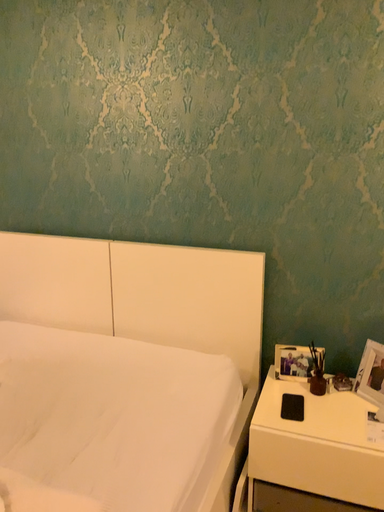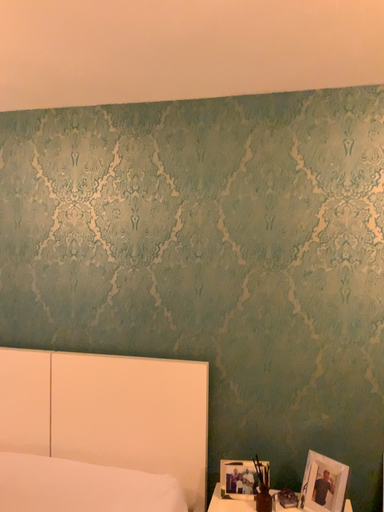
Question: Which way did the camera rotate in the video?

Choices:
 (A) rotated upward
 (B) rotated downward

Answer: (A)